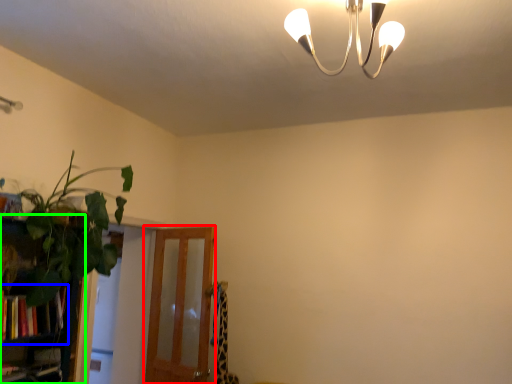
Question: Which is nearer to the screen door (highlighted by a red box)? book (highlighted by a blue box) or bookshelf (highlighted by a green box).

Choices:
 (A) book
 (B) bookshelf

Answer: (B)